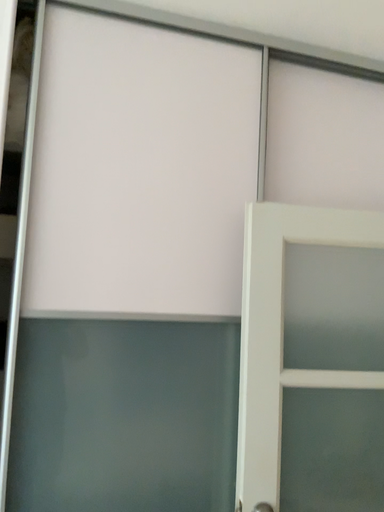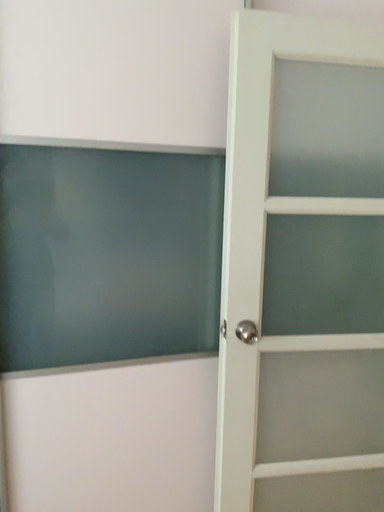
Question: How did the camera likely rotate when shooting the video?

Choices:
 (A) rotated upward
 (B) rotated downward

Answer: (B)